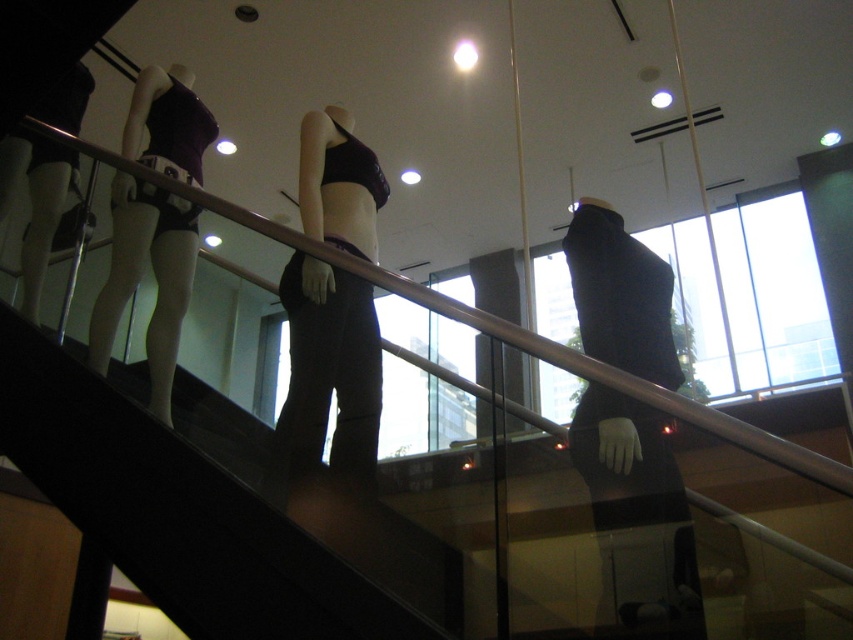
Question: Which object is the farthest from the matte black underwear at left?

Choices:
 (A) matte black leggings at center
 (B) smooth black stairs at center
 (C) black matte dress at center

Answer: (C)

Question: Does smooth black stairs at center appear over black matte dress at center?

Choices:
 (A) yes
 (B) no

Answer: (B)

Question: Does black matte dress at center have a larger size compared to matte black leggings at center?

Choices:
 (A) yes
 (B) no

Answer: (B)

Question: Does black matte dress at center lie in front of matte black leggings at center?

Choices:
 (A) no
 (B) yes

Answer: (A)

Question: Estimate the real-world distances between objects in this image. Which object is closer to the matte black leggings at center?

Choices:
 (A) black matte dress at center
 (B) matte black underwear at left
 (C) smooth black stairs at center

Answer: (C)

Question: Which of the following is the closest to the observer?

Choices:
 (A) (352, 180)
 (B) (10, 420)
 (C) (643, 481)
 (D) (117, 182)

Answer: (C)